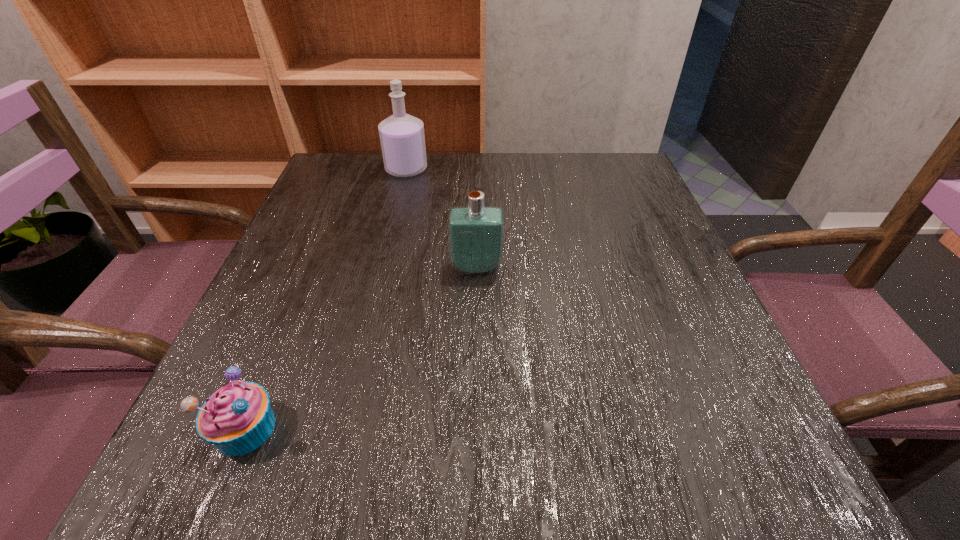
Identify the location of vacant space at the near left corner. (198, 490).

In the image, there is a desktop. Where is `vacant area at the far right corner`? vacant area at the far right corner is located at coordinates (604, 157).

At what (x,y) coordinates should I click in order to perform the action: click on vacant space at the near right corner of the desktop. Please return your answer as a coordinate pair (x, y). The image size is (960, 540). Looking at the image, I should click on (760, 465).

Find the location of a particular element. This screenshot has height=540, width=960. empty space between the shorter perfume and the taller perfume is located at coordinates (442, 218).

Image resolution: width=960 pixels, height=540 pixels. Find the location of `unoccupied area between the nearest object and the right perfume`. unoccupied area between the nearest object and the right perfume is located at coordinates (361, 348).

The image size is (960, 540). I want to click on vacant space that's between the rightmost object and the farthest object, so click(x=442, y=218).

Identify the location of free space between the nearest object and the right perfume. Image resolution: width=960 pixels, height=540 pixels. (361, 348).

Find the location of `empty space that is in between the taller perfume and the leftmost object`. empty space that is in between the taller perfume and the leftmost object is located at coordinates (326, 299).

Locate an element on the screen. empty location between the farthest object and the right perfume is located at coordinates (442, 218).

At what (x,y) coordinates should I click in order to perform the action: click on free space that is in between the muffin and the rightmost object. Please return your answer as a coordinate pair (x, y). This screenshot has width=960, height=540. Looking at the image, I should click on 361,348.